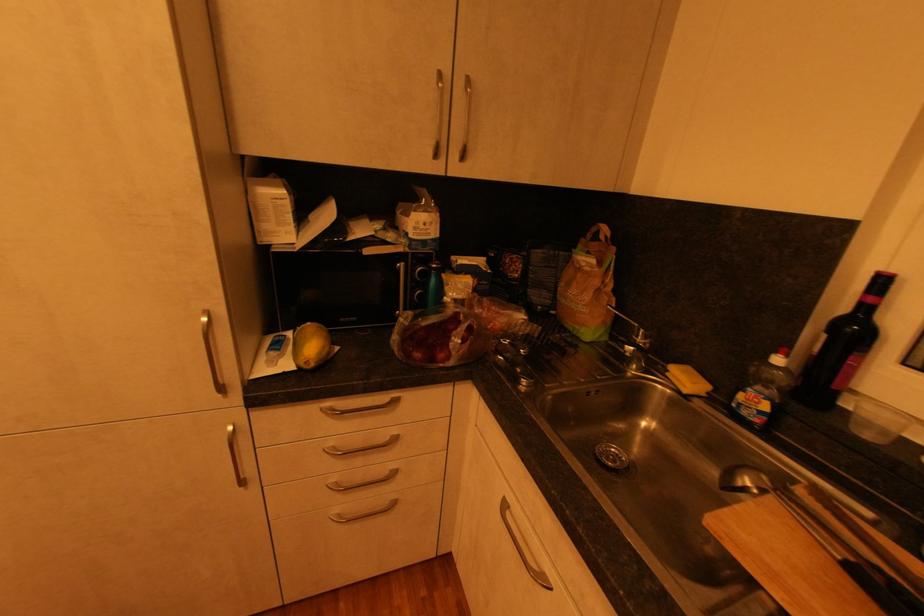
Which object does [842,347] point to?

This point indicates the dark wine bottle.